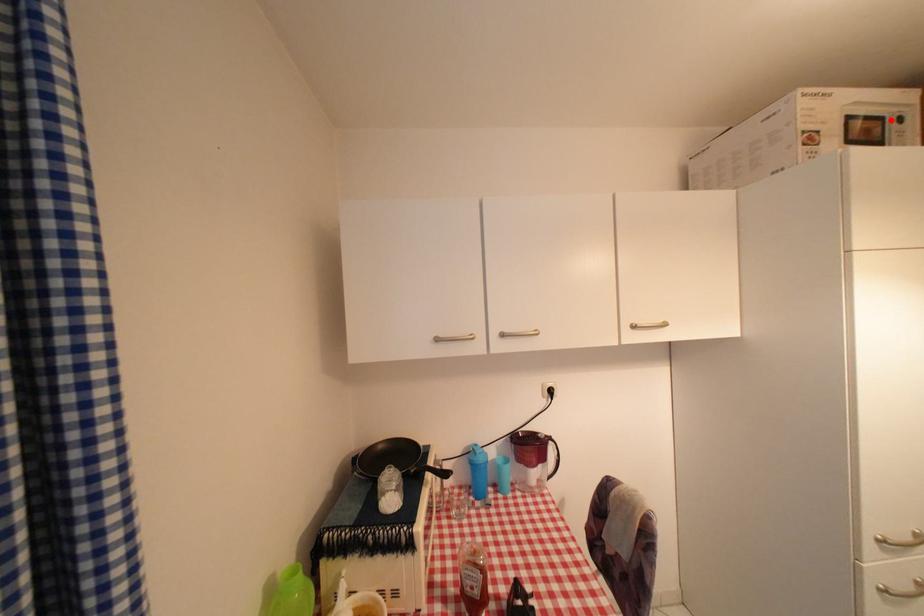
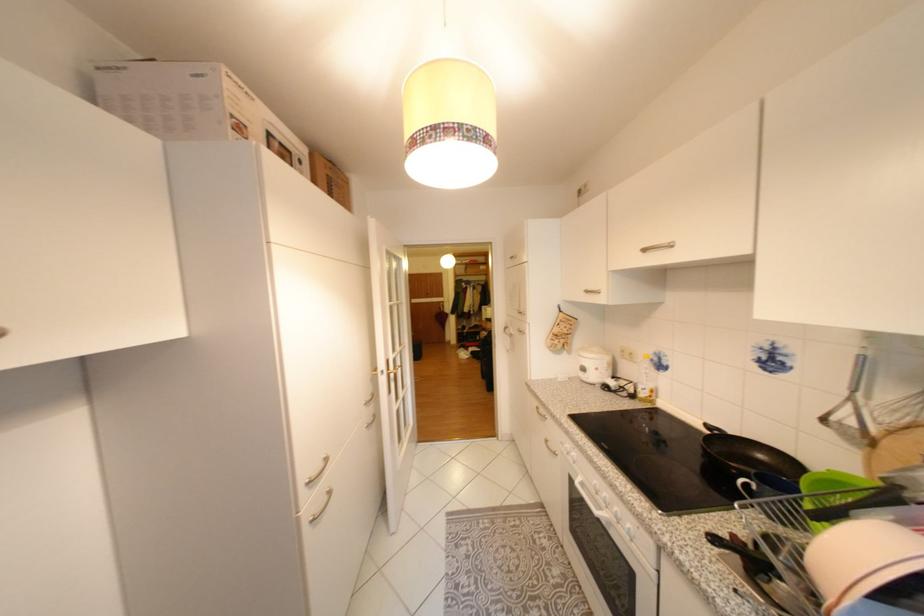
In the second image, find the point that corresponds to the highlighted location in the first image.

(299, 153)